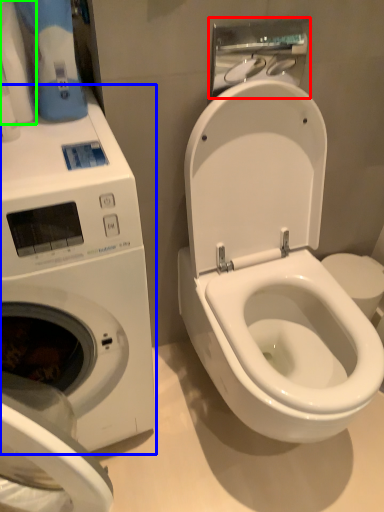
Question: Which object is the closest to the hand dryer (highlighted by a red box)? Choose among these: washing machine (highlighted by a blue box) or toilet paper (highlighted by a green box).

Choices:
 (A) washing machine
 (B) toilet paper

Answer: (B)